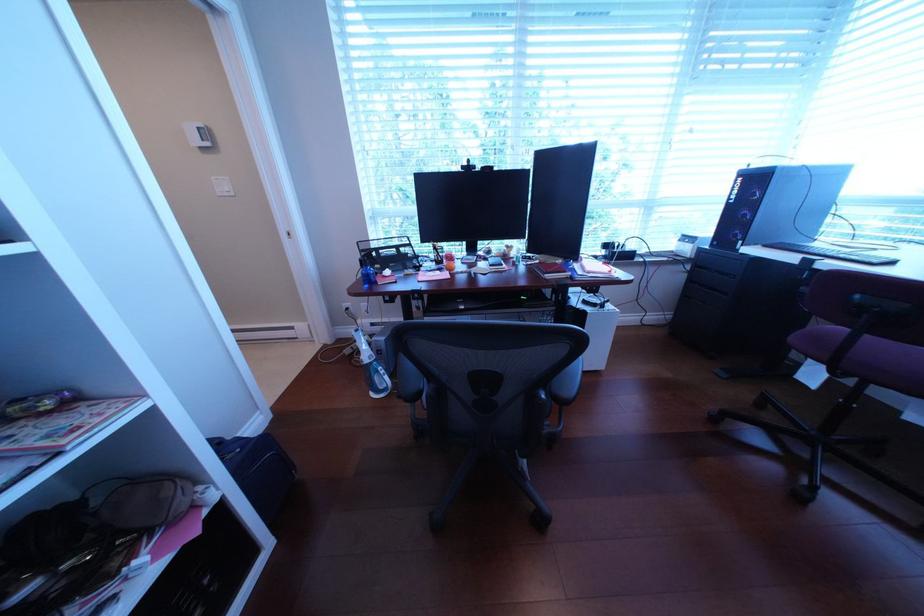
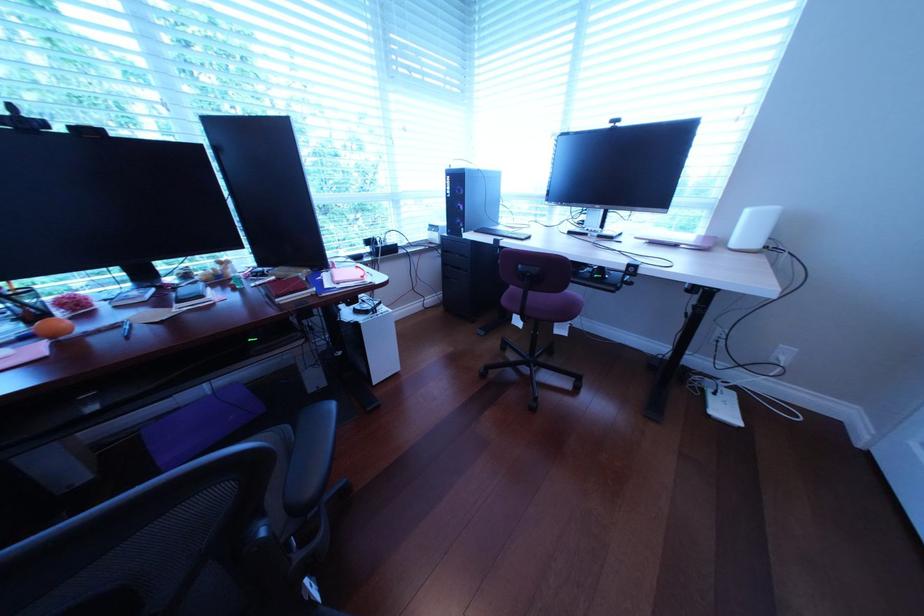
Question: The camera is either moving clockwise (left) or counter-clockwise (right) around the object. The first image is from the beginning of the video and the second image is from the end. Is the camera moving left or right when shooting the video?

Choices:
 (A) Left
 (B) Right

Answer: (A)